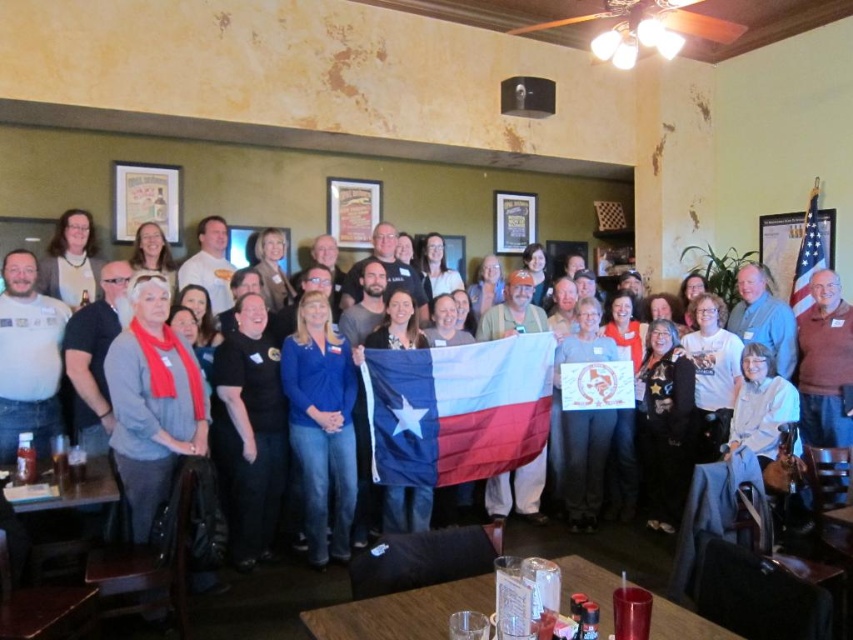
You are standing at the entrance of the room and want to find the polyester texas flag at center. According to the coordinates provided, in which direction should you look relative to your position?

The polyester texas flag at center is located at coordinates point (457, 410). Since the coordinate system typically places the origin at the bottom left corner, the flag is positioned to the right and slightly above the center point of the image. Therefore, you should look towards the right and slightly upward from your current position at the entrance to locate it.

You are a photographer trying to capture the Texas flag in the center of the image. The flag is represented by the point at coordinates point (457, 410). Can you confirm if this point is indeed the center of the image?

The point (457, 410) is the center of the image as the polyester texas flag at center is represented by this point.

You are a photographer at the event and want to capture a photo where both the polyester texas flag at center and the american flag at upper right are clearly visible. Which flag should you adjust your camera focus to prioritize to ensure both are in focus?

The polyester texas flag at center is closer to the viewer than the american flag at upper right. To ensure both are in focus, prioritize focusing on the polyester texas flag at center since it is closer, allowing the american flag at upper right to fall within the depth of field.